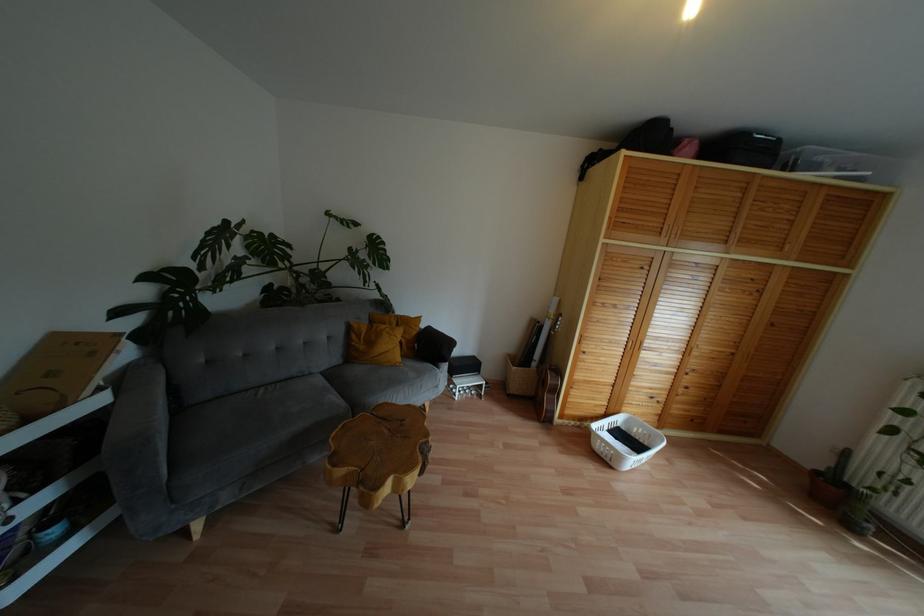
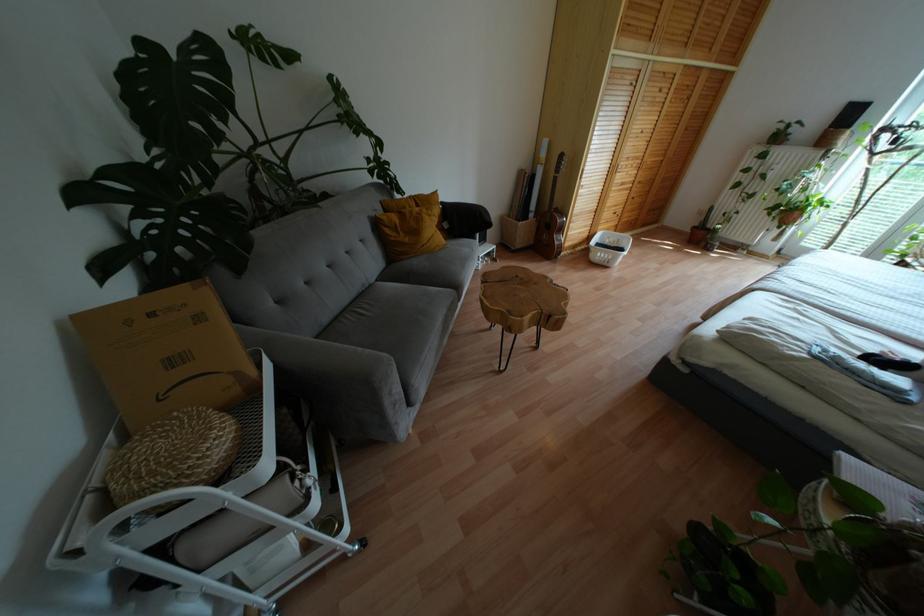
Where in the second image is the point corresponding to the point at 606,460 from the first image?

(604, 262)